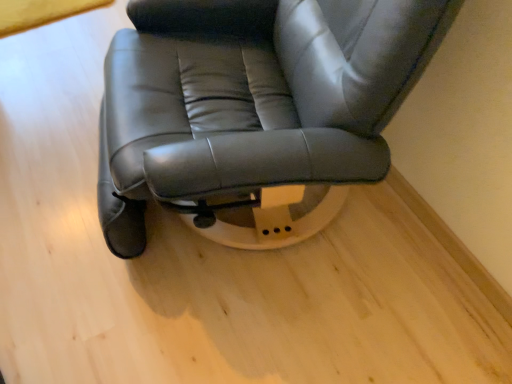
Find the location of a particular element. The height and width of the screenshot is (384, 512). free space to the left of matte black chair at center is located at coordinates (52, 142).